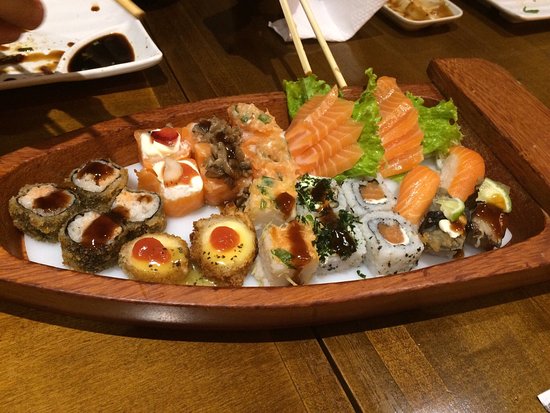
The height and width of the screenshot is (413, 550). I want to click on table, so coord(425,371).